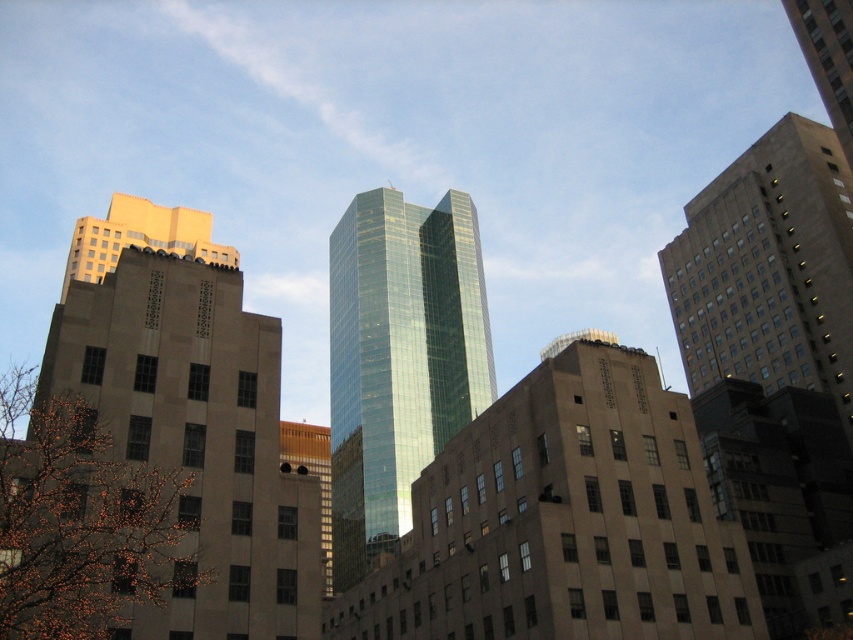
Question: Is beige stone building at left positioned in front of green glass skyscraper at center?

Choices:
 (A) yes
 (B) no

Answer: (A)

Question: Which is farther from the green glass skyscraper at center?

Choices:
 (A) green glass skyscraper at upper center
 (B) beige concrete building at right

Answer: (A)

Question: Considering the relative positions of beige stone building at left and green glass skyscraper at center in the image provided, where is beige stone building at left located with respect to green glass skyscraper at center?

Choices:
 (A) left
 (B) right

Answer: (A)

Question: Does beige stone building at left come in front of beige concrete building at right?

Choices:
 (A) yes
 (B) no

Answer: (A)

Question: Which object is the farthest from the green glass skyscraper at upper center?

Choices:
 (A) green glass skyscraper at center
 (B) beige stone building at left
 (C) beige concrete building at right

Answer: (A)

Question: Based on their relative distances, which object is nearer to the beige concrete building at right?

Choices:
 (A) green glass skyscraper at upper center
 (B) green glass skyscraper at center

Answer: (A)